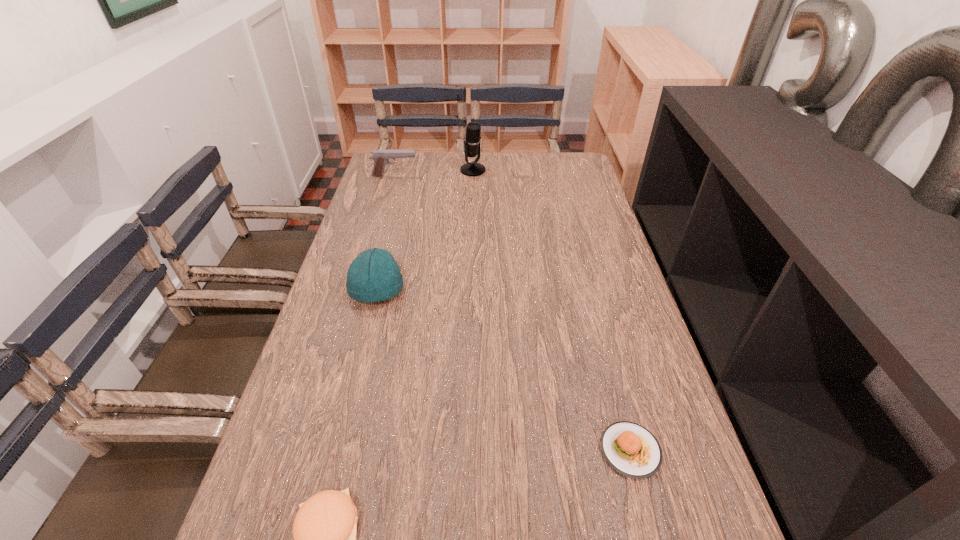
Find the location of `free space between the second object from right to left and the pistol`. free space between the second object from right to left and the pistol is located at coordinates (434, 173).

Find the location of a particular element. Image resolution: width=960 pixels, height=540 pixels. free space between the shortest object and the pistol is located at coordinates (513, 313).

Where is `unoccupied position between the microphone and the fourth farthest object`? unoccupied position between the microphone and the fourth farthest object is located at coordinates (552, 310).

The width and height of the screenshot is (960, 540). I want to click on vacant area that lies between the third nearest object and the fourth farthest object, so click(504, 370).

The width and height of the screenshot is (960, 540). Identify the location of vacant area between the microphone and the shortest object. (552, 310).

Where is `object identified as the fourth closest to the tallest object`? object identified as the fourth closest to the tallest object is located at coordinates (324, 530).

Point out which object is positioned as the fourth nearest to the right food. Please provide its 2D coordinates. Your answer should be formatted as a tuple, i.e. [(x, y)], where the tuple contains the x and y coordinates of a point satisfying the conditions above.

[(381, 157)]

Locate an element on the screen. free region that satisfies the following two spatial constraints: 1. at the barrel of the shorter food; 2. on the left side of the pistol is located at coordinates (316, 450).

In order to click on free spot that satisfies the following two spatial constraints: 1. on the back side of the beanie; 2. at the barrel of the pistol in this screenshot , I will do `click(406, 176)`.

Locate an element on the screen. Image resolution: width=960 pixels, height=540 pixels. free space that satisfies the following two spatial constraints: 1. at the barrel of the beanie; 2. on the left side of the pistol is located at coordinates (362, 291).